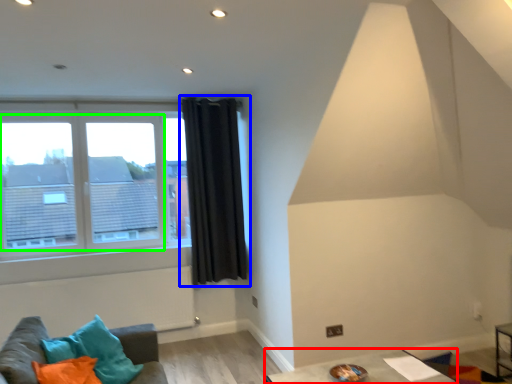
Question: Estimate the real-world distances between objects in this image. Which object is farther from table (highlighted by a red box), curtain (highlighted by a blue box) or bay window (highlighted by a green box)?

Choices:
 (A) curtain
 (B) bay window

Answer: (B)